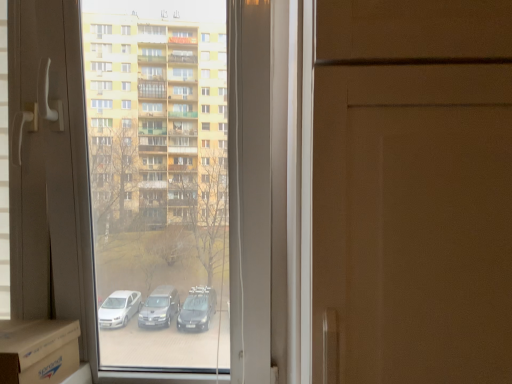
Question: Visually, is transparent glass window at center positioned to the left or to the right of cardboard at lower left?

Choices:
 (A) right
 (B) left

Answer: (A)

Question: Relative to cardboard at lower left, is transparent glass window at center in front or behind?

Choices:
 (A) front
 (B) behind

Answer: (B)

Question: Looking at the image, does transparent glass window at center seem bigger or smaller compared to cardboard at lower left?

Choices:
 (A) big
 (B) small

Answer: (A)

Question: From the image's perspective, is cardboard at lower left located above or below transparent glass window at center?

Choices:
 (A) below
 (B) above

Answer: (A)

Question: Visually, is cardboard at lower left positioned to the left or to the right of transparent glass window at center?

Choices:
 (A) left
 (B) right

Answer: (A)

Question: In terms of size, does cardboard at lower left appear bigger or smaller than transparent glass window at center?

Choices:
 (A) big
 (B) small

Answer: (B)

Question: Which is correct: cardboard at lower left is inside transparent glass window at center, or outside of it?

Choices:
 (A) inside
 (B) outside

Answer: (A)